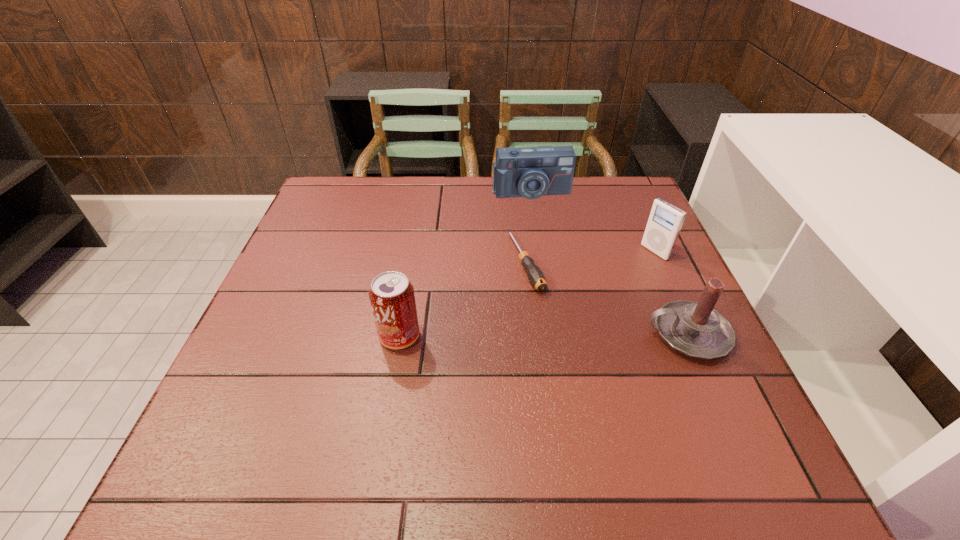
I want to click on vacant region that satisfies the following two spatial constraints: 1. on the front side of the iPod; 2. on the right side of the farthest object, so click(x=540, y=252).

At what (x,y) coordinates should I click in order to perform the action: click on free space that satisfies the following two spatial constraints: 1. on the front side of the farthest object; 2. on the left side of the iPod. Please return your answer as a coordinate pair (x, y). Image resolution: width=960 pixels, height=540 pixels. Looking at the image, I should click on (540, 252).